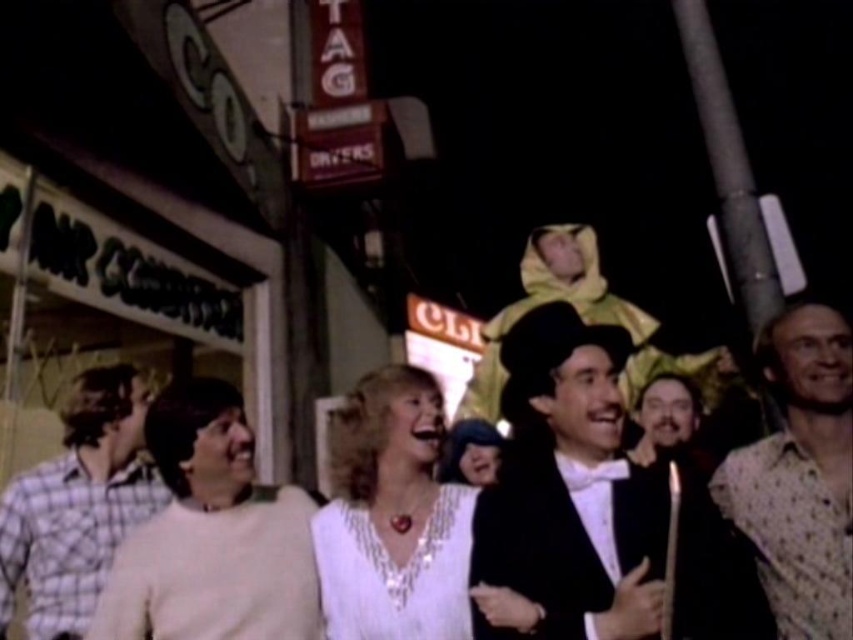
Is white cotton sweater at center further to the viewer compared to plaid cotton shirt at left?

That is False.

You are a GUI agent. You are given a task and a screenshot of the screen. Output one action in this format:
    pyautogui.click(x=<x>, y=<y>)
    Task: Click on the white cotton sweater at center
    
    Given the screenshot: What is the action you would take?
    pyautogui.click(x=212, y=534)

The height and width of the screenshot is (640, 853). Find the location of `white cotton sweater at center`. white cotton sweater at center is located at coordinates (212, 534).

Is black satin tuxedo at center positioned before white satin blouse at center?

Yes, black satin tuxedo at center is closer to the viewer.

Based on the photo, who is more distant from viewer, (598, 538) or (393, 598)?

Positioned behind is point (393, 598).

The width and height of the screenshot is (853, 640). I want to click on black satin tuxedo at center, so click(x=581, y=476).

Can you confirm if white satin blouse at center is bigger than plaid cotton shirt at left?

Yes.

Based on the photo, between white satin blouse at center and plaid cotton shirt at left, which one appears on the left side from the viewer's perspective?

plaid cotton shirt at left

Image resolution: width=853 pixels, height=640 pixels. What are the coordinates of `white satin blouse at center` in the screenshot? It's located at [x=393, y=516].

Locate an element on the screen. This screenshot has height=640, width=853. white satin blouse at center is located at coordinates (393, 516).